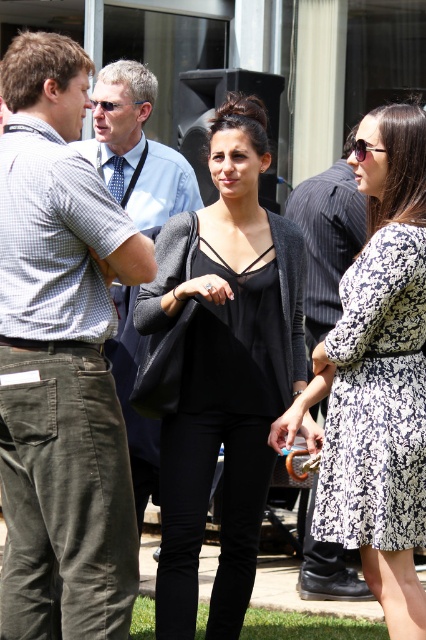
You are a photographer trying to capture a group photo of the black pinstripe shirt at center and the matte blue sunglasses at upper left. You want to ensure both subjects are in focus. Which subject requires more attention to ensure proper focus due to their size?

The black pinstripe shirt at center requires more attention to ensure proper focus because its width is larger than the matte blue sunglasses at upper left.

You are a photographer trying to capture a group photo of the light blue shirt at center and the matte blue sunglasses at upper left. Considering their sizes, which object should you focus on to ensure both fit in the frame without cropping?

The light blue shirt at center is wider than the matte blue sunglasses at upper left. To ensure both fit in the frame without cropping, focus on centering the light blue shirt at center since it has a larger width, allowing the matte blue sunglasses at upper left to fit within the same frame.